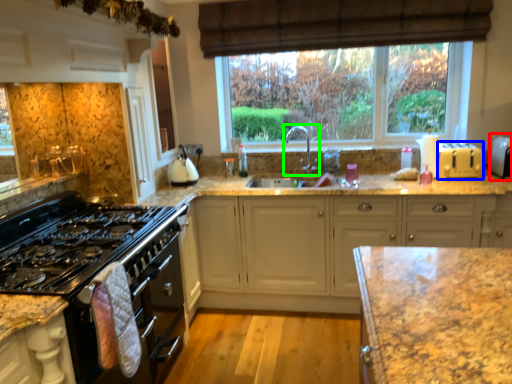
Question: Which object is the farthest from appliance (highlighted by a red box)? Choose among these: appliance (highlighted by a blue box) or tap (highlighted by a green box).

Choices:
 (A) appliance
 (B) tap

Answer: (B)